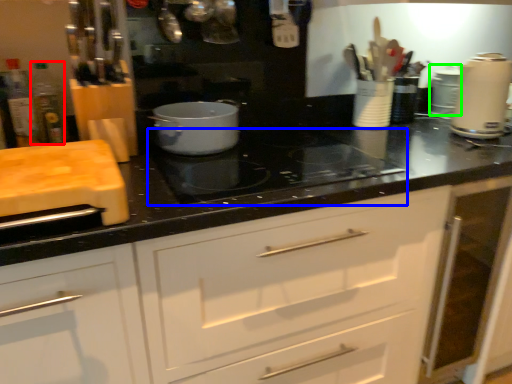
Question: Which is farther away from bottle (highlighted by a red box)? gas stove (highlighted by a blue box) or appliance (highlighted by a green box)?

Choices:
 (A) gas stove
 (B) appliance

Answer: (B)